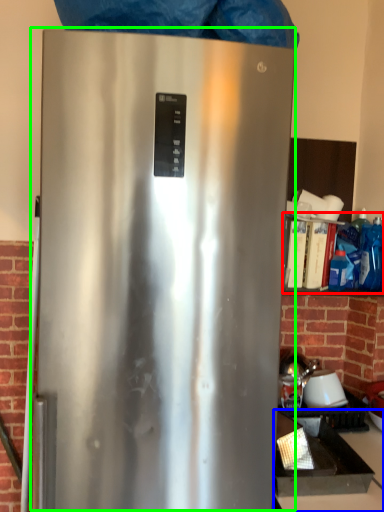
Question: Which object is positioned closest to shelf (highlighted by a red box)? Select from counter top (highlighted by a blue box) and refrigerator (highlighted by a green box).

Choices:
 (A) counter top
 (B) refrigerator

Answer: (A)